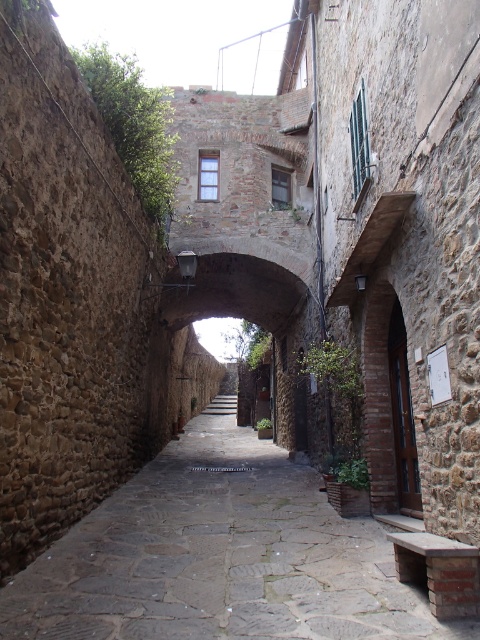
Question: Is stone paved alley at center smaller than stone archway at center?

Choices:
 (A) no
 (B) yes

Answer: (A)

Question: Among these objects, which one is nearest to the camera?

Choices:
 (A) stone paved alley at center
 (B) stone archway at center

Answer: (A)

Question: Is stone paved alley at center smaller than stone archway at center?

Choices:
 (A) no
 (B) yes

Answer: (A)

Question: Does stone paved alley at center come in front of stone archway at center?

Choices:
 (A) no
 (B) yes

Answer: (B)

Question: Which point appears closest to the camera in this image?

Choices:
 (A) (410, 618)
 (B) (213, 272)

Answer: (A)